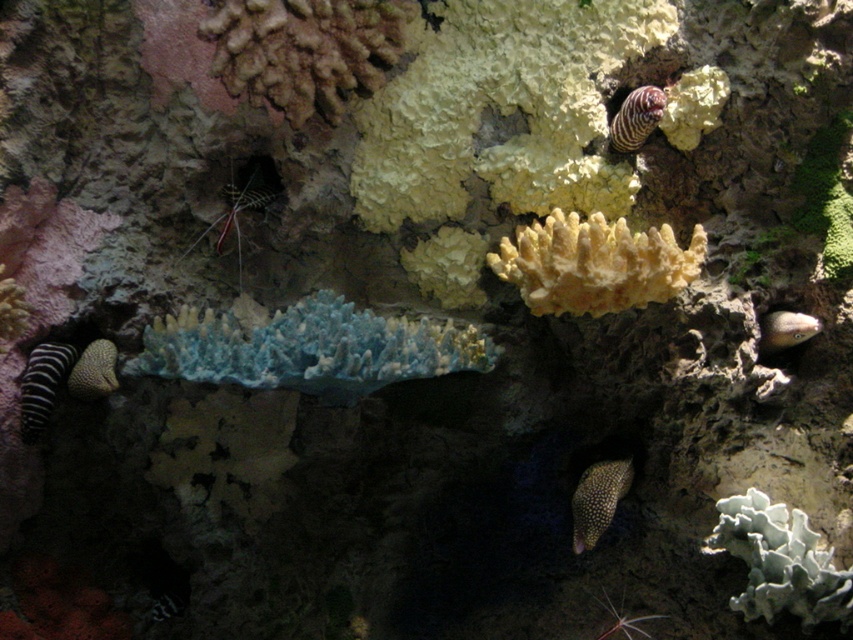
You are a scuba diver exploring this underwater scene. You spot two points marked in the image. Which point, point (358, 371) or point (631, 291), is closer to you?

Point (358, 371) is closer to the viewer than point (631, 291).

You are an underwater explorer looking at the blue translucent coral at center and the yellow matte coral at center. Which coral is positioned to the left?

The blue translucent coral at center is positioned to the left of the yellow matte coral at center.